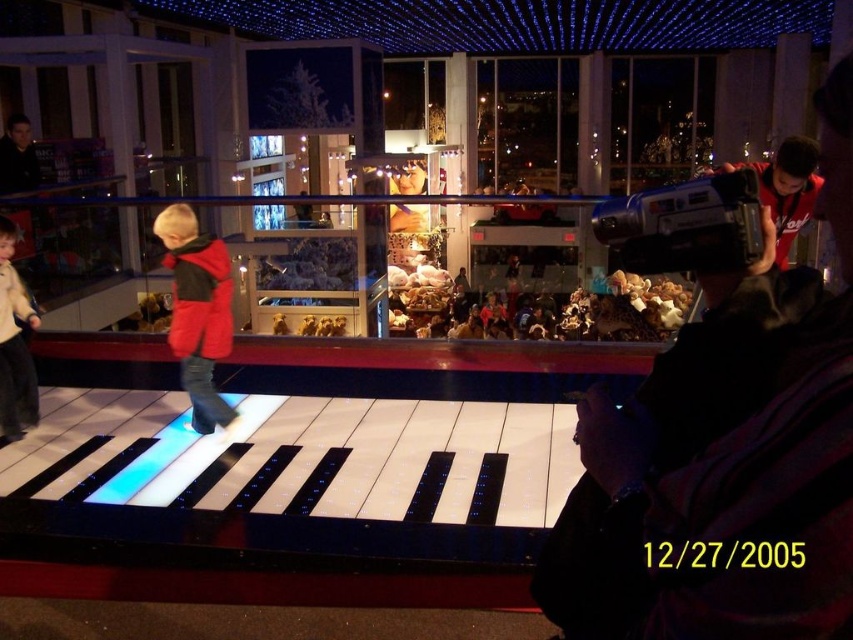
Question: Based on their relative distances, which object is nearer to the light beige sweater at left?

Choices:
 (A) red matte jacket at center
 (B) matte black camera at right

Answer: (A)

Question: Is the position of matte black camera at right more distant than that of light beige sweater at left?

Choices:
 (A) yes
 (B) no

Answer: (B)

Question: Which object appears closest to the camera in this image?

Choices:
 (A) light beige sweater at left
 (B) matte black camera at right
 (C) red matte jacket at center

Answer: (B)

Question: In this image, where is red matte jacket at center located relative to light beige sweater at left?

Choices:
 (A) right
 (B) left

Answer: (A)

Question: In this image, where is matte black camera at right located relative to red matte jacket at center?

Choices:
 (A) right
 (B) left

Answer: (A)

Question: Which object is closer to the camera taking this photo?

Choices:
 (A) red matte jacket at center
 (B) light beige sweater at left
 (C) matte black camera at right

Answer: (C)